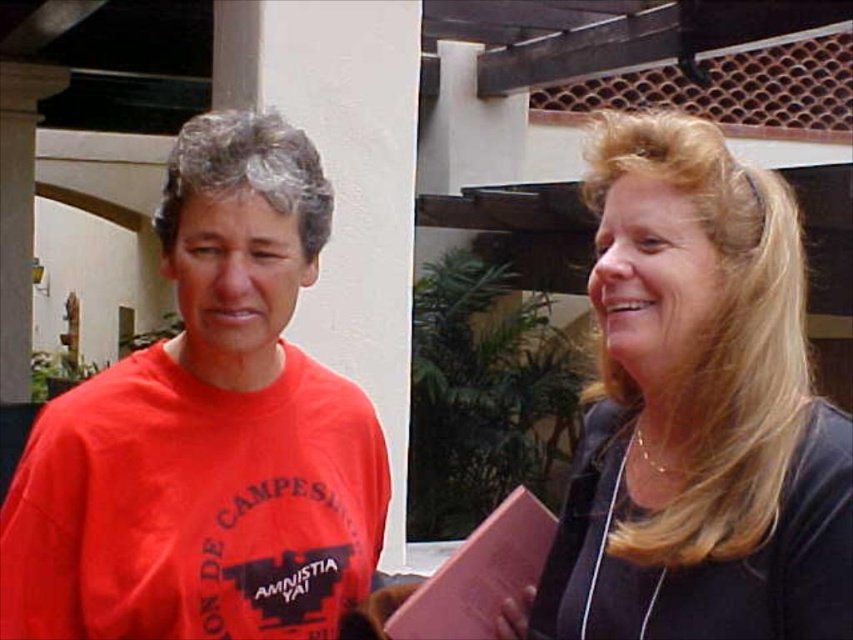
You are standing at point (96, 552) in the courtyard. A friend is standing 1.34 meters away from you. Where is your friend located relative to you?

Your friend is located 1.34 meters away from you at point (96, 552).